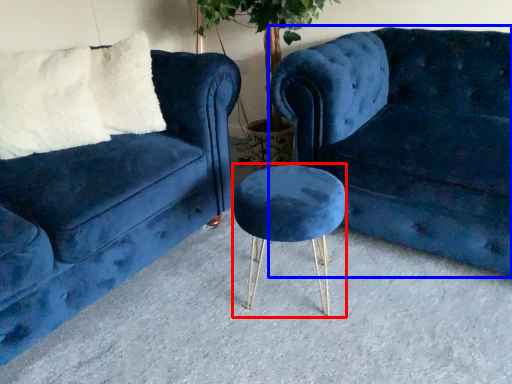
Question: Which object appears farthest to the camera in this image, bar stool (highlighted by a red box) or studio couch (highlighted by a blue box)?

Choices:
 (A) bar stool
 (B) studio couch

Answer: (A)